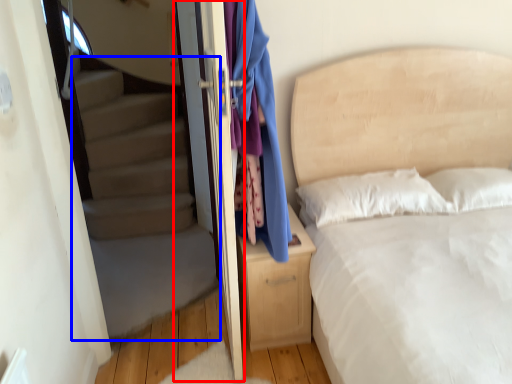
Question: Which of the following is the closest to the observer, screen door (highlighted by a red box) or stairwell (highlighted by a blue box)?

Choices:
 (A) screen door
 (B) stairwell

Answer: (A)